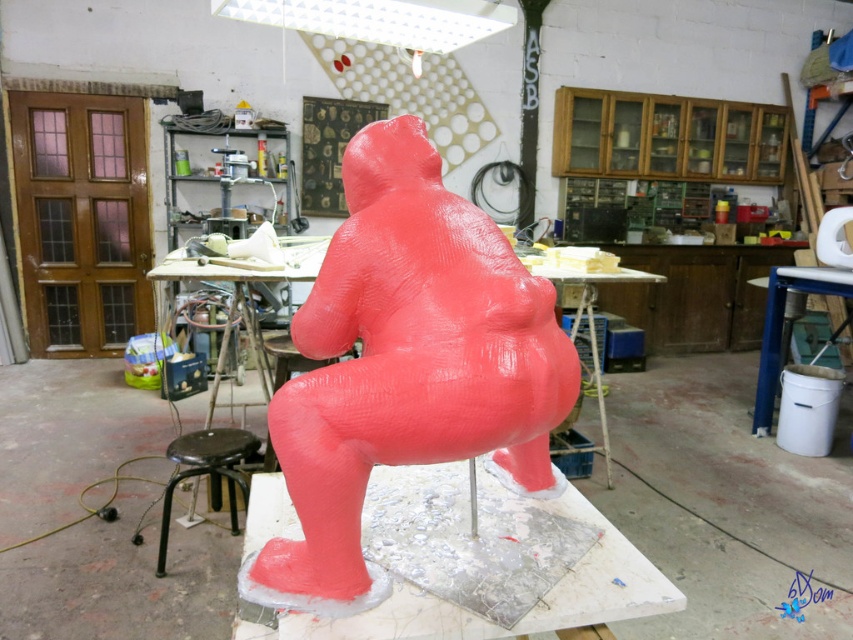
Which of these two, matte pink sculpture at center or black metal stool at lower left, stands shorter?

black metal stool at lower left is shorter.

Is point (457, 276) behind point (221, 470)?

No, it is in front of (221, 470).

You are a GUI agent. You are given a task and a screenshot of the screen. Output one action in this format:
    pyautogui.click(x=<x>, y=<y>)
    Task: Click on the matte pink sculpture at center
    This screenshot has width=853, height=640.
    Given the screenshot: What is the action you would take?
    pyautogui.click(x=405, y=365)

Find the location of a particular element. The width and height of the screenshot is (853, 640). matte pink sculpture at center is located at coordinates (405, 365).